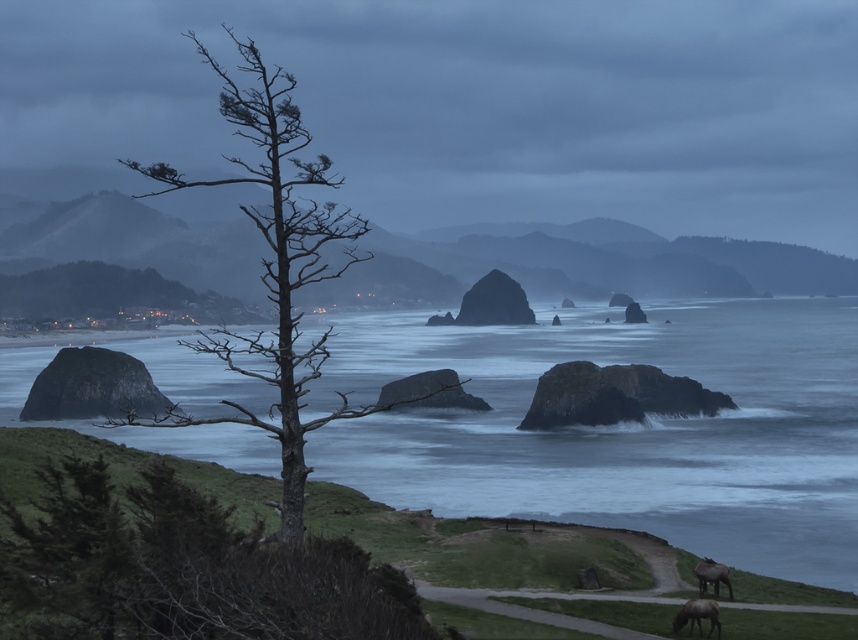
Question: Considering the relative positions of brown rough tree at center-left and brown furry horse at lower right in the image provided, where is brown rough tree at center-left located with respect to brown furry horse at lower right?

Choices:
 (A) left
 (B) right

Answer: (A)

Question: Among these objects, which one is nearest to the camera?

Choices:
 (A) bare wood tree at left
 (B) blue water at center
 (C) brown rough tree at center-left
 (D) brown furry horse at lower right

Answer: (A)

Question: Which point is farther to the camera?

Choices:
 (A) blue water at center
 (B) brown furry horse at lower right
 (C) brown matte horse at lower right

Answer: (A)

Question: Which point is farther to the camera?

Choices:
 (A) bare wood tree at left
 (B) brown furry horse at lower right
 (C) brown matte horse at lower right
 (D) brown rough tree at center-left

Answer: (C)

Question: Can you confirm if brown rough tree at center-left is smaller than brown furry horse at lower right?

Choices:
 (A) yes
 (B) no

Answer: (B)

Question: Can you confirm if blue water at center is smaller than bare wood tree at left?

Choices:
 (A) no
 (B) yes

Answer: (A)